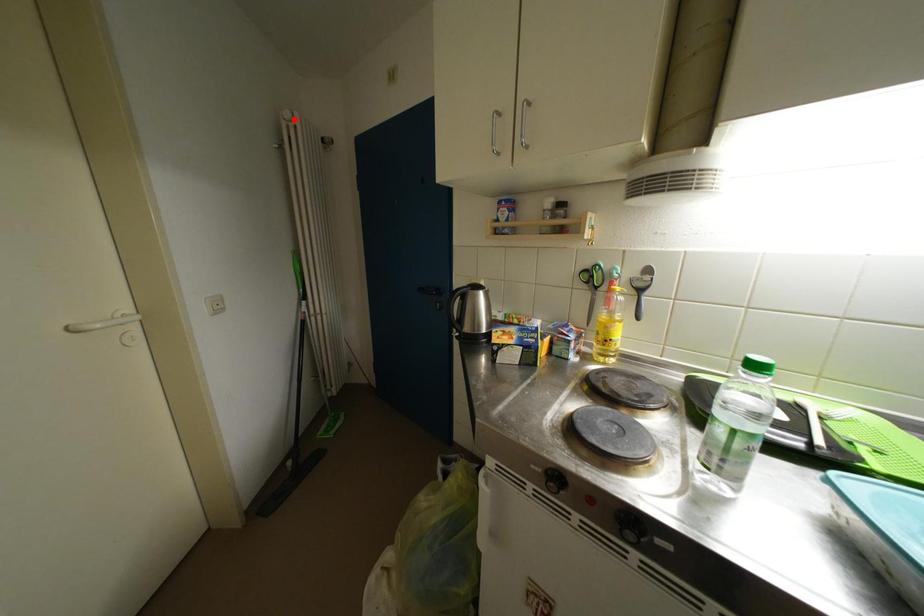
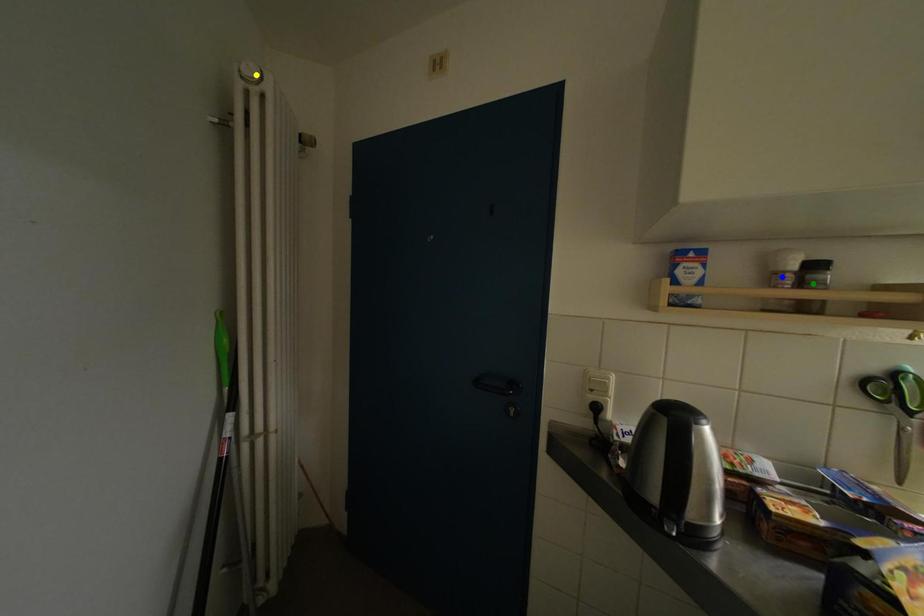
Question: I am providing you with two images of the same scene from different viewpoints. A red point is marked on the first image. You are given multiple points on the second image. Which point in image 2 represents the same 3d spot as the red point in image 1?

Choices:
 (A) green point
 (B) blue point
 (C) yellow point

Answer: (C)